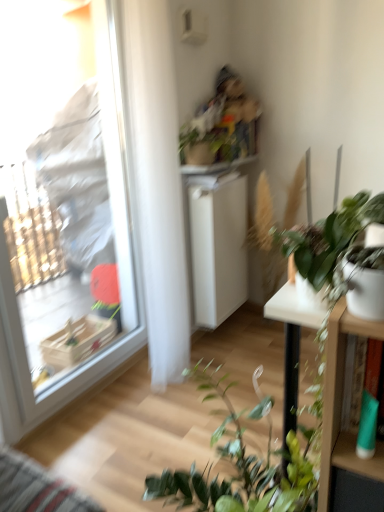
Question: From a real-world perspective, is green matte plant at right, the 1th houseplant positioned from the front, under green matte plant at upper center, acting as the 1th houseplant starting from the top?

Choices:
 (A) no
 (B) yes

Answer: (B)

Question: From a real-world perspective, is green matte plant at right, the second houseplant viewed from the top, physically above green matte plant at upper center, the 1th houseplant when ordered from back to front?

Choices:
 (A) yes
 (B) no

Answer: (B)

Question: Can we say green matte plant at right, the 1th houseplant positioned from the front, lies outside green matte plant at upper center, the 2th houseplant viewed from the front?

Choices:
 (A) no
 (B) yes

Answer: (B)

Question: Is green matte plant at right, the 1th houseplant positioned from the front, to the left of green matte plant at upper center, the 1th houseplant when ordered from back to front, from the viewer's perspective?

Choices:
 (A) yes
 (B) no

Answer: (B)

Question: Considering the relative sizes of green matte plant at right, the second houseplant viewed from the top, and green matte plant at upper center, the 2th houseplant viewed from the front, in the image provided, is green matte plant at right, the second houseplant viewed from the top, wider than green matte plant at upper center, the 2th houseplant viewed from the front,?

Choices:
 (A) yes
 (B) no

Answer: (B)

Question: Looking at their shapes, would you say white glossy table at right is wider or thinner than transparent plastic window at left?

Choices:
 (A) wide
 (B) thin

Answer: (B)

Question: Considering the positions of point (296, 356) and point (67, 120), is point (296, 356) closer or farther from the camera than point (67, 120)?

Choices:
 (A) closer
 (B) farther

Answer: (A)

Question: Is white glossy table at right in front of or behind transparent plastic window at left in the image?

Choices:
 (A) behind
 (B) front

Answer: (B)

Question: Is white glossy table at right to the left or to the right of transparent plastic window at left in the image?

Choices:
 (A) right
 (B) left

Answer: (A)

Question: In the image, is white matte cabinet at center on the left side or the right side of green matte plant at upper center, acting as the 1th houseplant starting from the top?

Choices:
 (A) left
 (B) right

Answer: (B)

Question: Relative to green matte plant at upper center, which is the second houseplant from bottom to top, is white matte cabinet at center in front or behind?

Choices:
 (A) behind
 (B) front

Answer: (A)

Question: Looking at their shapes, would you say white matte cabinet at center is wider or thinner than green matte plant at upper center, the 1th houseplant when ordered from back to front?

Choices:
 (A) wide
 (B) thin

Answer: (B)

Question: In terms of size, does white matte cabinet at center appear bigger or smaller than green matte plant at upper center, the 2th houseplant viewed from the front?

Choices:
 (A) big
 (B) small

Answer: (A)

Question: Is white matte cabinet at center in front of or behind transparent plastic window at left in the image?

Choices:
 (A) front
 (B) behind

Answer: (B)

Question: From the image's perspective, is white matte cabinet at center above or below transparent plastic window at left?

Choices:
 (A) below
 (B) above

Answer: (A)